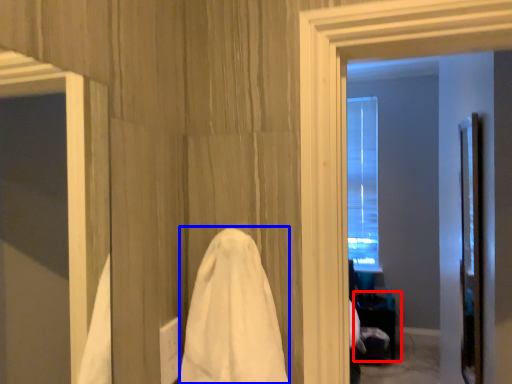
Question: Which point is further to the camera, table (highlighted by a red box) or bath towel (highlighted by a blue box)?

Choices:
 (A) table
 (B) bath towel

Answer: (A)